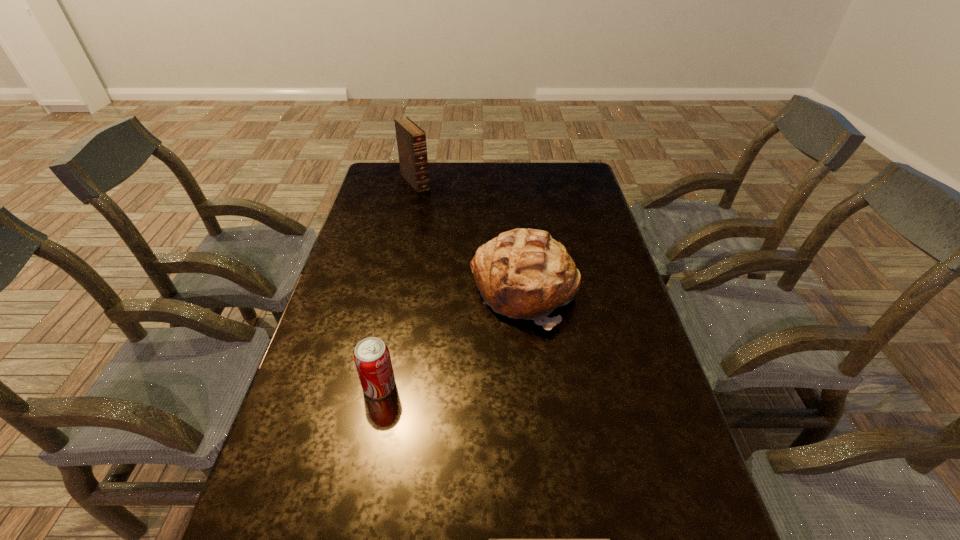
Where is `empty location between the third tallest object and the second farthest object`? Image resolution: width=960 pixels, height=540 pixels. empty location between the third tallest object and the second farthest object is located at coordinates (452, 339).

This screenshot has width=960, height=540. What are the coordinates of `free space between the second farthest object and the soda can` in the screenshot? It's located at (452, 339).

The height and width of the screenshot is (540, 960). Identify the location of free space between the left Bible and the second tallest object. (469, 237).

This screenshot has height=540, width=960. What are the coordinates of `free area in between the second nearest object and the farther Bible` in the screenshot? It's located at (397, 284).

Locate an element on the screen. object that can be found as the second closest to the shorter Bible is located at coordinates (523, 273).

The width and height of the screenshot is (960, 540). Identify the location of the closest object to the third farthest object. (523, 273).

This screenshot has width=960, height=540. Find the location of `free location that satisfies the following two spatial constraints: 1. on the front side of the farthest object; 2. on the right side of the second nearest object`. free location that satisfies the following two spatial constraints: 1. on the front side of the farthest object; 2. on the right side of the second nearest object is located at coordinates (372, 386).